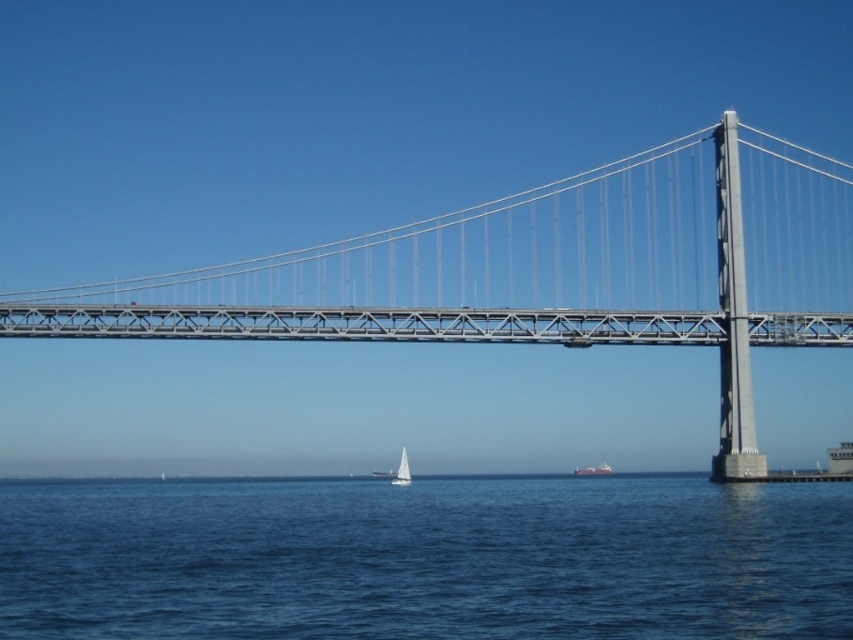
Question: Which of the following is the closest to the observer?

Choices:
 (A) coord(596,472)
 (B) coord(405,461)
 (C) coord(457,515)
 (D) coord(138,321)

Answer: (C)

Question: Among these points, which one is farthest from the camera?

Choices:
 (A) (283, 600)
 (B) (724, 403)

Answer: (B)

Question: Can you confirm if blue water at center is wider than white matte sailboat at center?

Choices:
 (A) yes
 (B) no

Answer: (A)

Question: Does metallic gray suspension bridge at center lie in front of white matte sailboat at center?

Choices:
 (A) yes
 (B) no

Answer: (A)

Question: Is blue water at center closer to the viewer compared to metallic gray suspension bridge at center?

Choices:
 (A) yes
 (B) no

Answer: (A)

Question: Which of the following is the closest to the observer?

Choices:
 (A) (578, 474)
 (B) (842, 618)

Answer: (B)